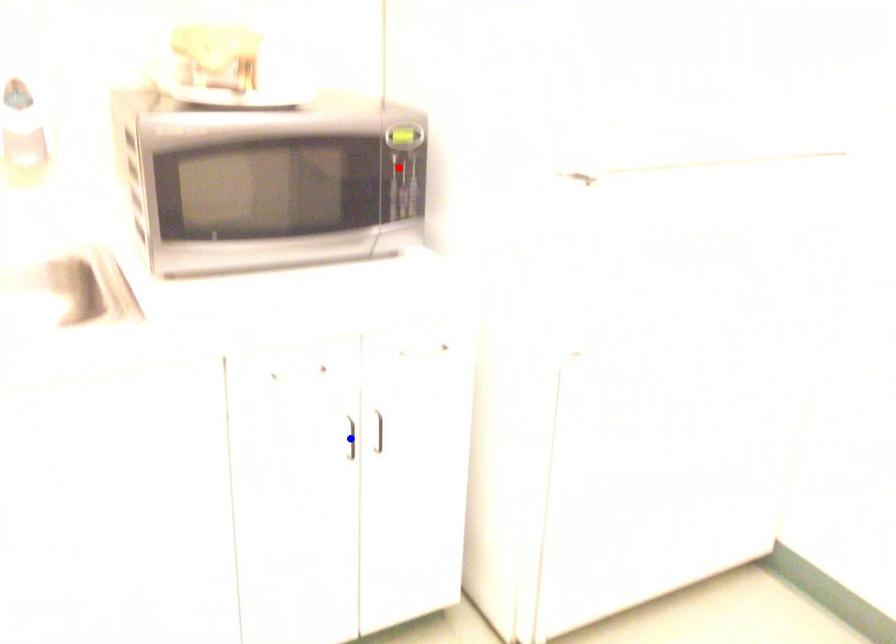
Question: In the image, two points are highlighted. Which point is nearer to the camera? Reply with the corresponding letter.

Choices:
 (A) blue point
 (B) red point

Answer: (A)